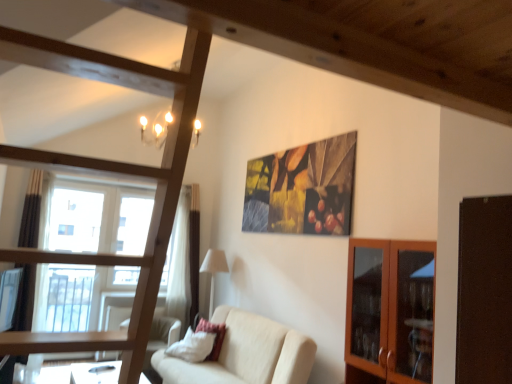
Question: In terms of width, does beige fabric couch at center look wider or thinner when compared to white fabric lampshade at center?

Choices:
 (A) thin
 (B) wide

Answer: (B)

Question: Considering their positions, is beige fabric couch at center located in front of or behind white fabric lampshade at center?

Choices:
 (A) front
 (B) behind

Answer: (A)

Question: Which object is the farthest from the wooden frame bunk bed at center?

Choices:
 (A) velvet red pillow at lower center
 (B) white fabric lampshade at center
 (C) beige fabric couch at center
 (D) wooden glass cabinet at right

Answer: (B)

Question: Which object is positioned closest to the wooden glass cabinet at right?

Choices:
 (A) wooden frame bunk bed at center
 (B) white fabric lampshade at center
 (C) beige fabric couch at center
 (D) velvet red pillow at lower center

Answer: (C)